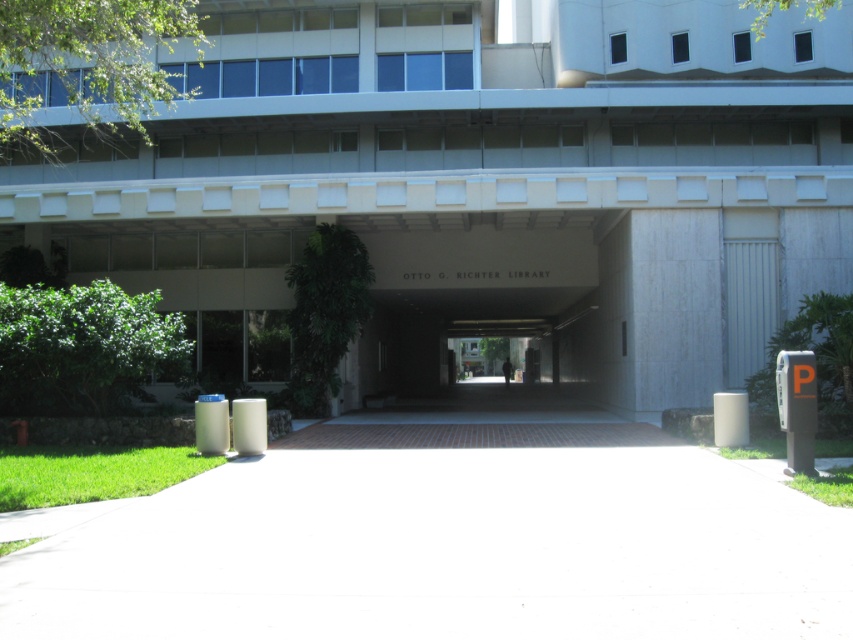
Question: Which object appears farthest from the camera in this image?

Choices:
 (A) white concrete pavement at lower center
 (B) white concrete parking garage at center

Answer: (B)

Question: Which object appears closest to the camera in this image?

Choices:
 (A) white concrete parking garage at center
 (B) white concrete pavement at lower center

Answer: (B)

Question: Does white concrete parking garage at center appear over white concrete pavement at lower center?

Choices:
 (A) yes
 (B) no

Answer: (A)

Question: Does white concrete parking garage at center appear on the right side of white concrete pavement at lower center?

Choices:
 (A) yes
 (B) no

Answer: (B)

Question: Can you confirm if white concrete parking garage at center is positioned to the right of white concrete pavement at lower center?

Choices:
 (A) no
 (B) yes

Answer: (A)